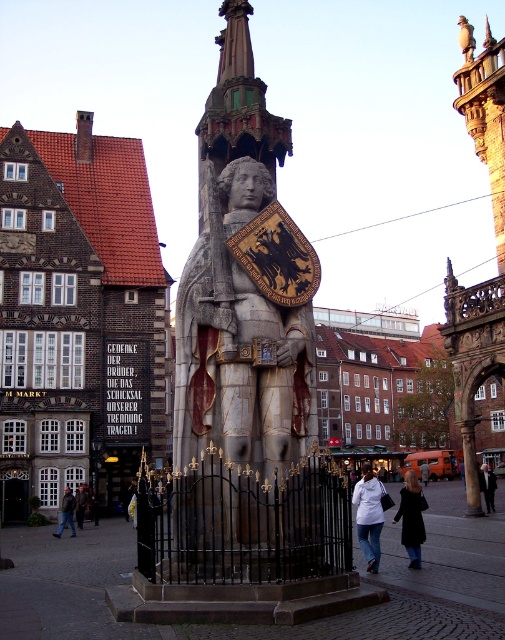
Question: Estimate the real-world distances between objects in this image. Which object is farther from the black leather coat at lower right?

Choices:
 (A) dark blue jeans at lower left
 (B) dark brown leather jacket at lower left

Answer: (B)

Question: Which object is positioned farthest from the polished stone statue at center?

Choices:
 (A) dark blue jeans at lower left
 (B) white fabric coat at center
 (C) dark brown leather jacket at lower left
 (D) black leather coat at lower right

Answer: (C)

Question: Considering the relative positions of polished stone statue at center and black leather coat at lower right in the image provided, where is polished stone statue at center located with respect to black leather coat at lower right?

Choices:
 (A) below
 (B) above

Answer: (B)

Question: Is dark brown leather jacket at lower left thinner than orange wool coat at center?

Choices:
 (A) yes
 (B) no

Answer: (A)

Question: Can you confirm if polished stone statue at center is positioned to the right of dark blue jeans at lower left?

Choices:
 (A) no
 (B) yes

Answer: (B)

Question: Which point is closer to the camera taking this photo?

Choices:
 (A) (410, 481)
 (B) (424, 483)
 (C) (256, 163)
 (D) (72, 493)

Answer: (C)